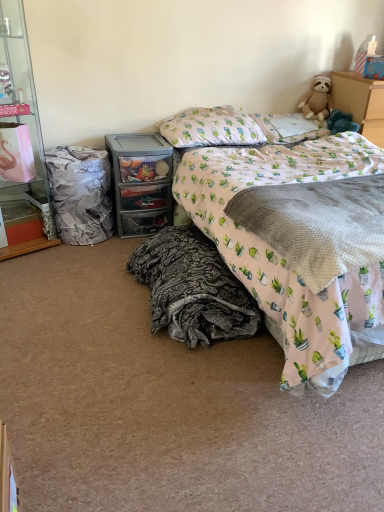
This screenshot has height=512, width=384. I want to click on empty space that is in between clear glass cabinet at left and marble-patterned laundry basket at left, so click(55, 252).